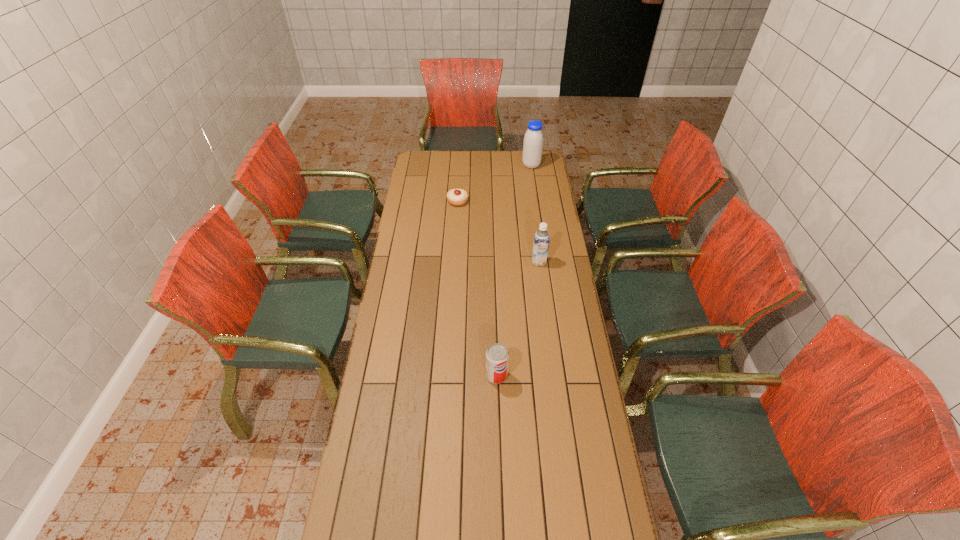
This screenshot has width=960, height=540. I want to click on free space located on the left of the soda, so click(421, 375).

Locate an element on the screen. This screenshot has height=540, width=960. free space located on the back of the second farthest object is located at coordinates (460, 164).

The width and height of the screenshot is (960, 540). I want to click on object that is at the far edge, so click(533, 140).

Find the location of a particular element. The image size is (960, 540). object that is at the far right corner is located at coordinates pyautogui.click(x=533, y=140).

I want to click on vacant space at the far edge of the desktop, so click(462, 172).

You are a GUI agent. You are given a task and a screenshot of the screen. Output one action in this format:
    pyautogui.click(x=<x>, y=<y>)
    Task: Click on the vacant space at the left edge
    The width and height of the screenshot is (960, 540).
    Given the screenshot: What is the action you would take?
    pyautogui.click(x=414, y=292)

Identify the location of vacant space at the right edge. Image resolution: width=960 pixels, height=540 pixels. (540, 201).

Where is `vacant space at the far left corner of the desktop`? This screenshot has width=960, height=540. vacant space at the far left corner of the desktop is located at coordinates (424, 156).

Find the location of a particular element. free space at the far right corner of the desktop is located at coordinates (544, 160).

What are the coordinates of `free space between the second nearest object and the shortest object` in the screenshot? It's located at (498, 232).